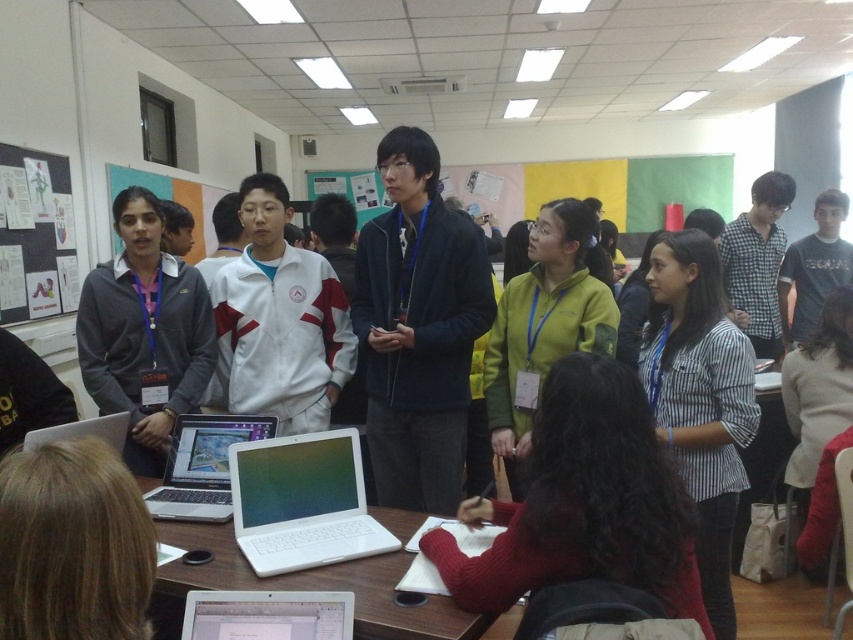
Question: Can you confirm if blonde hair at lower left is smaller than white plastic laptop at lower center?

Choices:
 (A) no
 (B) yes

Answer: (B)

Question: Does matte gray hoodie at center appear on the right side of white glossy table at lower center?

Choices:
 (A) yes
 (B) no

Answer: (B)

Question: Which object appears closest to the camera in this image?

Choices:
 (A) silver metallic laptop at center
 (B) red sweater at center

Answer: (B)

Question: Which point is farther to the camera?

Choices:
 (A) red sweater at center
 (B) matte gray hoodie at center
 (C) green fleece jacket at center
 (D) white glossy laptop at center

Answer: (B)

Question: Does striped cotton shirt at center have a larger size compared to black matte poster at upper left?

Choices:
 (A) yes
 (B) no

Answer: (A)

Question: Which point is closer to the camera taking this photo?

Choices:
 (A) (361, 227)
 (B) (263, 515)
 (C) (549, 208)
 (D) (685, 385)

Answer: (B)